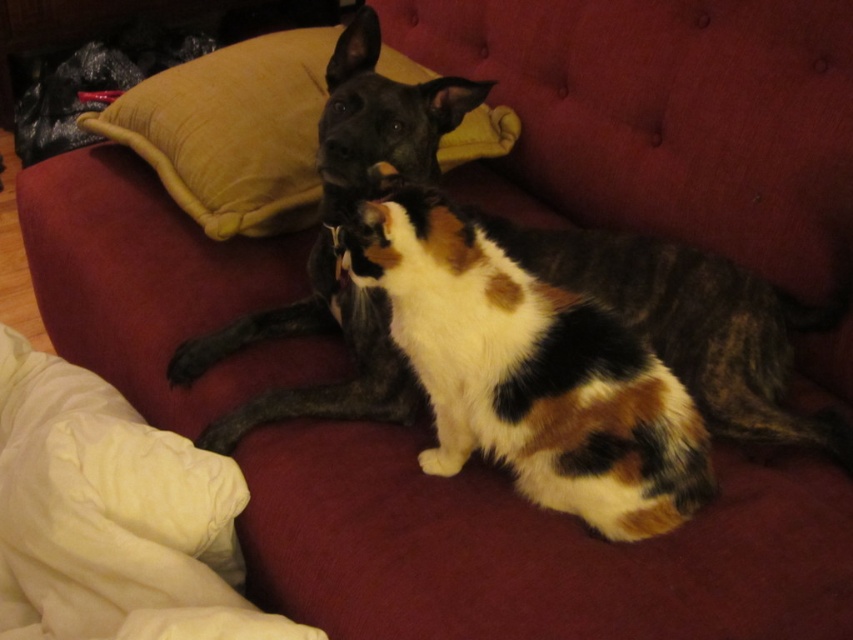
Based on the photo, is calico fur cat at center below velvet yellow pillow at upper center?

Yes, calico fur cat at center is below velvet yellow pillow at upper center.

Can you confirm if calico fur cat at center is wider than velvet yellow pillow at upper center?

No, calico fur cat at center is not wider than velvet yellow pillow at upper center.

Between point (494, 328) and point (125, 136), which one is positioned behind?

Point (125, 136)

Locate an element on the screen. The width and height of the screenshot is (853, 640). calico fur cat at center is located at coordinates (529, 372).